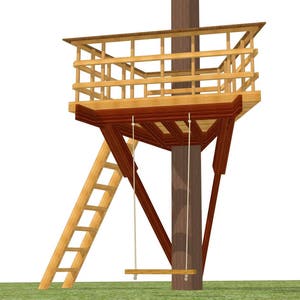
Where is `ladder steps`? ladder steps is located at coordinates (67, 270), (76, 249), (84, 230), (93, 208), (102, 188), (111, 164).